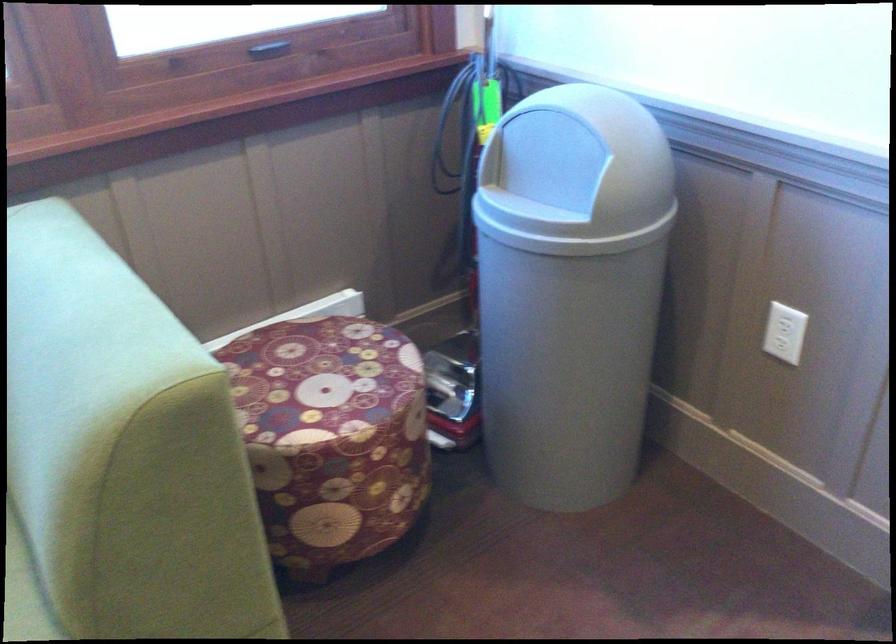
Locate an element on the screen. The height and width of the screenshot is (644, 896). black window latch is located at coordinates (270, 49).